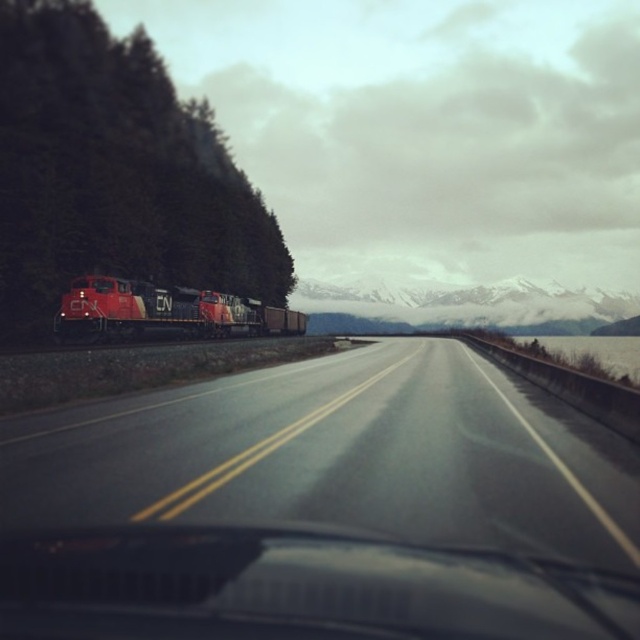
You are a passenger in the vehicle and want to know which of the two points, point (x=32, y=234) or point (x=205, y=307), is closer to you. Based on the scene, can you determine this?

Point (x=32, y=234) is closer to the camera than point (x=205, y=307), so it is closer to you as a passenger in the vehicle.

You are a passenger in the car and looking out the window. You see the green matte tree at left and the matte red train at left. Which object is closer to the car?

The green matte tree at left is closer to the car because it has a larger size compared to the matte red train at left, which appears smaller and thus farther away.

You are a driver in a car with a 10 meter long trailer attached. You see the green matte tree at left through the windshield. Can you safely back up your vehicle and trailer into the space behind you without hitting the tree?

The green matte tree at left is 40.93 meters away from the camera, so yes, the driver can safely back up their vehicle and trailer into the space behind them without hitting the tree since the distance is much greater than the 10 meter length of the trailer.